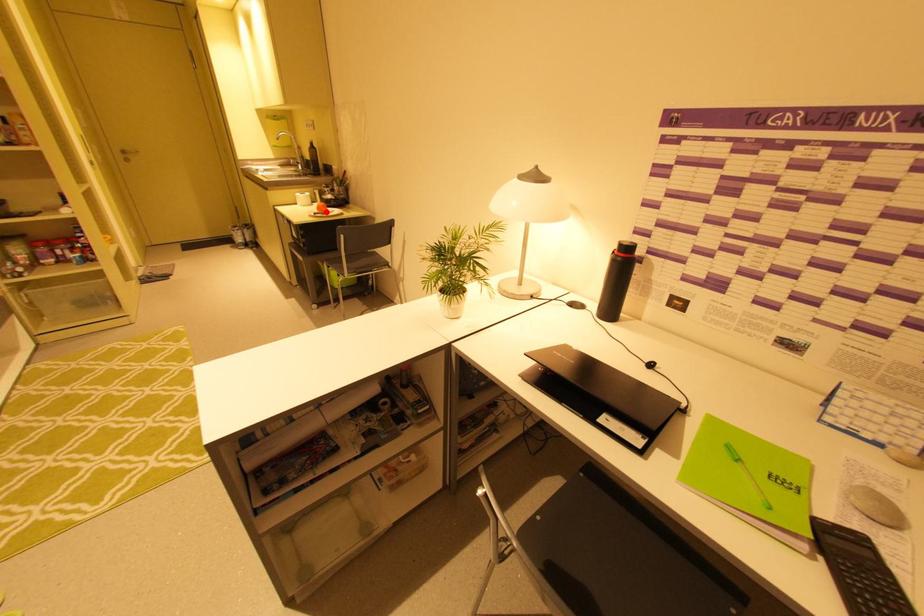
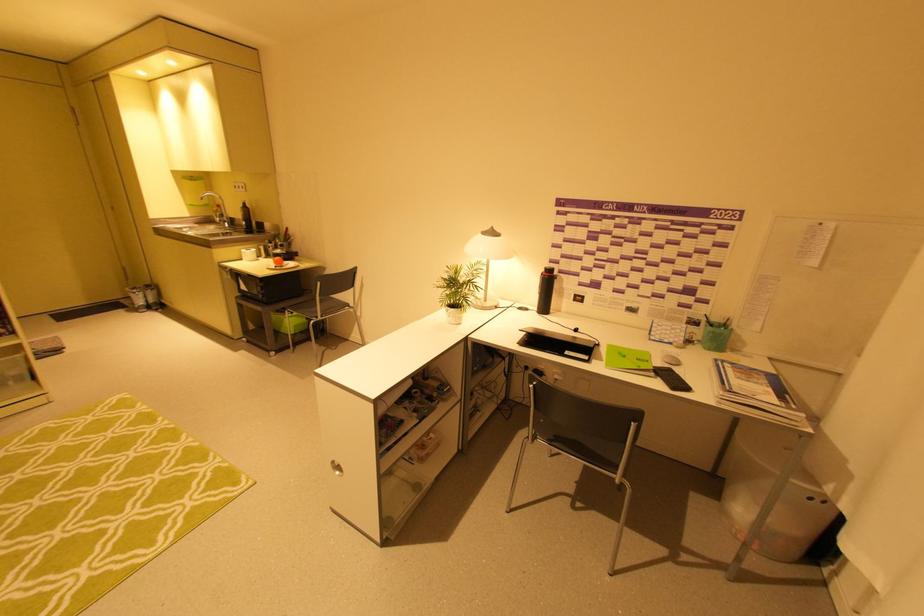
Find the pixel in the second image that matches the highlighted location in the first image.

(283, 265)